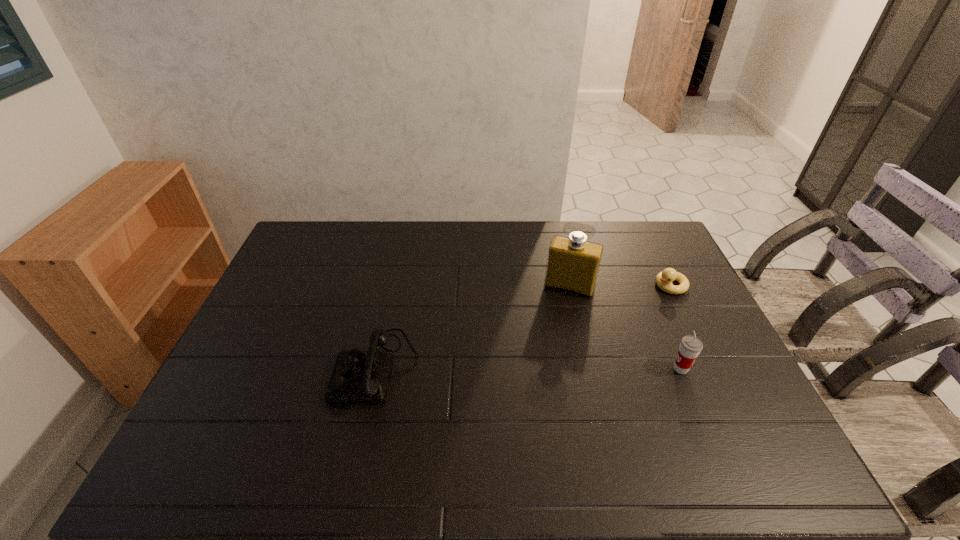
The width and height of the screenshot is (960, 540). Find the location of `vacant point located between the cup and the perfume`. vacant point located between the cup and the perfume is located at coordinates (625, 328).

You are a GUI agent. You are given a task and a screenshot of the screen. Output one action in this format:
    pyautogui.click(x=<x>, y=<y>)
    Task: Click on the vacant area between the leftmost object and the tallest object
    This screenshot has width=960, height=540.
    Given the screenshot: What is the action you would take?
    pyautogui.click(x=473, y=328)

This screenshot has width=960, height=540. In order to click on free spot between the cup and the shortest object in this screenshot , I will do `click(676, 327)`.

The image size is (960, 540). Identify the location of free point between the shortest object and the cup. (676, 327).

The width and height of the screenshot is (960, 540). Identify the location of free space that is in between the cup and the tallest object. (625, 328).

Image resolution: width=960 pixels, height=540 pixels. Find the location of `free area in between the duckling and the telephone`. free area in between the duckling and the telephone is located at coordinates (523, 327).

The width and height of the screenshot is (960, 540). I want to click on unoccupied position between the duckling and the telephone, so [523, 327].

Where is `the third closest object to the tallest object`? This screenshot has height=540, width=960. the third closest object to the tallest object is located at coordinates (359, 377).

The image size is (960, 540). Identify the location of object that stands as the third closest to the shortest object. (359, 377).